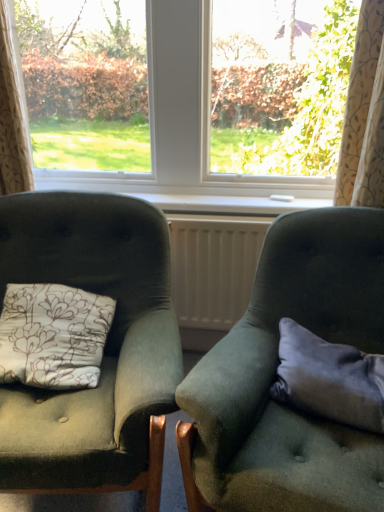
Measure the distance between point (x=202, y=254) and camera.

They are 6.01 feet apart.

The width and height of the screenshot is (384, 512). What do you see at coordinates (364, 116) in the screenshot? I see `beige floral fabric curtain at upper right, which ranks as the 2th curtain in left-to-right order` at bounding box center [364, 116].

This screenshot has height=512, width=384. Describe the element at coordinates (329, 379) in the screenshot. I see `gray fabric pillow at right` at that location.

This screenshot has width=384, height=512. In order to click on white plastic radiator at center in this screenshot , I will do `click(227, 204)`.

Locate an element on the screen. white plastic radiator at center is located at coordinates (214, 267).

Is white plastic radiator at center aimed at gray fabric pillow at right?

No.

From the image's perspective, does white plastic radiator at center appear lower than gray fabric pillow at right?

No.

Is point (213, 210) closer or farther from the camera than point (320, 400)?

Point (213, 210) is positioned farther from the camera compared to point (320, 400).

From the image's perspective, is velvet green armchair at left, which is the 2th chair in right-to-left order, under white plastic radiator at center?

Indeed, from the image's perspective, velvet green armchair at left, which is the 2th chair in right-to-left order, is shown beneath white plastic radiator at center.

Is white plastic radiator at center a part of velvet green armchair at left, the first chair when ordered from left to right?

No.

Is gray fabric pillow at right completely or partially inside white plastic radiator at center?

No, gray fabric pillow at right is not a part of white plastic radiator at center.

Considering the relative sizes of white plastic radiator at center and gray fabric pillow at right in the image provided, is white plastic radiator at center taller than gray fabric pillow at right?

Yes, white plastic radiator at center is taller than gray fabric pillow at right.

Is the depth of white plastic radiator at center greater than that of gray fabric pillow at right?

Yes, it is behind gray fabric pillow at right.

Can you see white plastic radiator at center touching gray fabric pillow at right?

There is a gap between white plastic radiator at center and gray fabric pillow at right.

From the gray fabric pillow at right, count 1st curtains backward and point to it. Please provide its 2D coordinates.

[(364, 116)]

Is point (372, 155) behind point (289, 400)?

Yes, point (372, 155) is farther from viewer.

In terms of height, does beige floral fabric curtain at upper right, acting as the 1th curtain starting from the right, look taller or shorter compared to gray fabric pillow at right?

beige floral fabric curtain at upper right, acting as the 1th curtain starting from the right, is taller than gray fabric pillow at right.

Looking at this image, is the depth of beige floral fabric curtain at upper right, which ranks as the 2th curtain in left-to-right order, greater than that of gray fabric pillow at right?

Yes, the depth of beige floral fabric curtain at upper right, which ranks as the 2th curtain in left-to-right order, is greater than that of gray fabric pillow at right.

Are white plastic radiator at center and beige floral fabric curtain at upper right, acting as the 1th curtain starting from the right, located far from each other?

No, white plastic radiator at center is in close proximity to beige floral fabric curtain at upper right, acting as the 1th curtain starting from the right.

Which of these two, white plastic radiator at center or beige floral fabric curtain at upper right, acting as the 1th curtain starting from the right, stands taller?

beige floral fabric curtain at upper right, acting as the 1th curtain starting from the right.

Is white plastic radiator at center wider or thinner than beige floral fabric curtain at upper right, which ranks as the 2th curtain in left-to-right order?

Considering their sizes, white plastic radiator at center looks slimmer than beige floral fabric curtain at upper right, which ranks as the 2th curtain in left-to-right order.

Is white plastic radiator at center positioned with its back to beige floral fabric curtain at upper right, which ranks as the 2th curtain in left-to-right order?

white plastic radiator at center does not have its back to beige floral fabric curtain at upper right, which ranks as the 2th curtain in left-to-right order.

Between gray fabric pillow at right and transparent glass window at center, which one has smaller width?

gray fabric pillow at right is thinner.

Which is correct: gray fabric pillow at right is inside transparent glass window at center, or outside of it?

gray fabric pillow at right is located beyond the bounds of transparent glass window at center.

In the image, is gray fabric pillow at right on the left side or the right side of transparent glass window at center?

Based on their positions, gray fabric pillow at right is located to the right of transparent glass window at center.

Is gray fabric pillow at right facing towards transparent glass window at center?

No, gray fabric pillow at right is not aimed at transparent glass window at center.

Consider the image. Is transparent glass window at center surrounding gray fabric pillow at right?

That's incorrect, gray fabric pillow at right is not inside transparent glass window at center.

Between transparent glass window at center and gray fabric pillow at right, which one has larger size?

With larger size is transparent glass window at center.

In the image, is transparent glass window at center on the left side or the right side of gray fabric pillow at right?

Clearly, transparent glass window at center is on the left of gray fabric pillow at right in the image.

Considering the positions of objects transparent glass window at center and gray fabric pillow at right in the image provided, who is behind, transparent glass window at center or gray fabric pillow at right?

transparent glass window at center is more distant.

You are a GUI agent. You are given a task and a screenshot of the screen. Output one action in this format:
    pyautogui.click(x=<x>, y=<y>)
    Task: Click on the pillow located on the right of white plastic radiator at center
    The height and width of the screenshot is (512, 384).
    Given the screenshot: What is the action you would take?
    pyautogui.click(x=329, y=379)

This screenshot has height=512, width=384. I want to click on radiator behind the velvet green armchair at left, the first chair when ordered from left to right, so click(x=214, y=267).

Which object lies further to the anchor point beige floral fabric curtain at upper right, acting as the 1th curtain starting from the right, velvet green armchair at left, the first chair when ordered from left to right, or white plastic radiator at center?

Among the two, velvet green armchair at left, the first chair when ordered from left to right, is located further to beige floral fabric curtain at upper right, acting as the 1th curtain starting from the right.

Looking at the image, which one is located further to white plastic radiator at center, velvet green armchair at right, acting as the 2th chair starting from the left, or beige floral fabric curtain at upper right, which ranks as the 2th curtain in left-to-right order?

beige floral fabric curtain at upper right, which ranks as the 2th curtain in left-to-right order.

From the image, which object appears to be farther from beige floral fabric curtain at upper right, which ranks as the 2th curtain in left-to-right order, white plastic radiator at center or velvet green armchair at left, the first chair when ordered from left to right?

velvet green armchair at left, the first chair when ordered from left to right, is further to beige floral fabric curtain at upper right, which ranks as the 2th curtain in left-to-right order.

Considering their positions, is velvet green armchair at right, arranged as the first chair when viewed from the right, positioned further to gray fabric pillow at right than transparent glass window at center?

transparent glass window at center is further to gray fabric pillow at right.

Estimate the real-world distances between objects in this image. Which object is closer to velvet green armchair at right, acting as the 2th chair starting from the left, white plastic radiator at center or floral fabric curtain at left, positioned as the second curtain in right-to-left order?

white plastic radiator at center lies closer to velvet green armchair at right, acting as the 2th chair starting from the left, than the other object.

Considering their positions, is gray fabric pillow at right positioned closer to transparent glass window at center than white plastic radiator at center?

white plastic radiator at center is positioned closer to the anchor transparent glass window at center.

When comparing their distances from beige floral fabric curtain at upper right, which ranks as the 2th curtain in left-to-right order, does white plastic radiator at center or gray fabric pillow at right seem further?

gray fabric pillow at right lies further to beige floral fabric curtain at upper right, which ranks as the 2th curtain in left-to-right order, than the other object.

Based on their spatial positions, is floral fabric curtain at left, positioned as the second curtain in right-to-left order, or white plastic radiator at center closer to velvet green armchair at right, acting as the 2th chair starting from the left?

white plastic radiator at center.

Find the location of `window between velvet green armchair at right, acting as the 2th chair starting from the left, and white plastic radiator at center in the front-back direction`. window between velvet green armchair at right, acting as the 2th chair starting from the left, and white plastic radiator at center in the front-back direction is located at coordinates (156, 120).

Where is `window sill between transparent glass window at center and beige floral fabric curtain at upper right, acting as the 1th curtain starting from the right`? The width and height of the screenshot is (384, 512). window sill between transparent glass window at center and beige floral fabric curtain at upper right, acting as the 1th curtain starting from the right is located at coordinates (227, 204).

Locate an element on the screen. This screenshot has height=512, width=384. window sill between transparent glass window at center and gray fabric pillow at right in the up-down direction is located at coordinates (227, 204).

The height and width of the screenshot is (512, 384). I want to click on window situated between floral fabric curtain at left, which is the first curtain in left-to-right order, and beige floral fabric curtain at upper right, acting as the 1th curtain starting from the right, from left to right, so tap(156, 120).